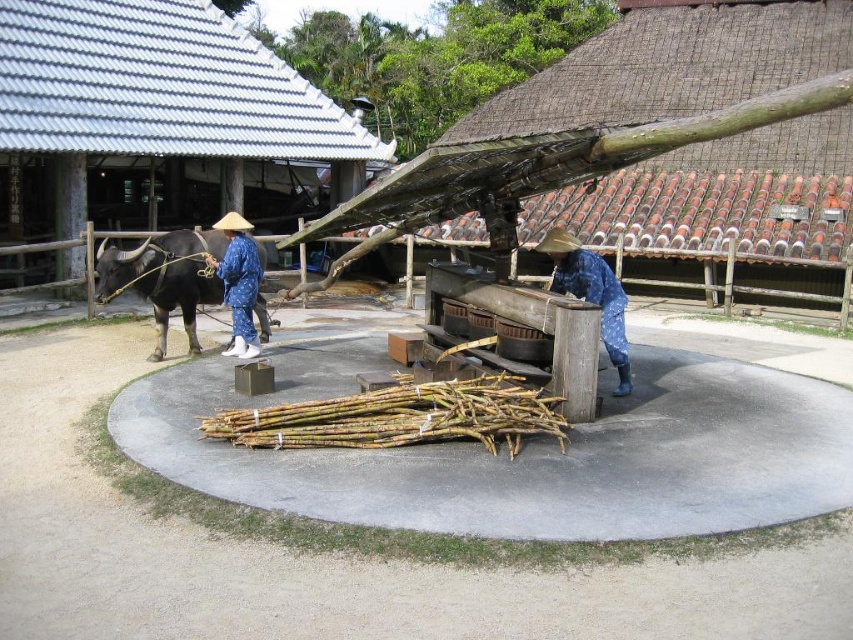
Question: Does blue dotted fabric at center appear on the right side of blue fabric hat at center?

Choices:
 (A) yes
 (B) no

Answer: (A)

Question: Which is farther from the blue dotted fabric at center?

Choices:
 (A) brown rough sugar cane at center
 (B) blue fabric hat at center

Answer: (B)

Question: Considering the real-world distances, which object is closest to the blue fabric hat at center?

Choices:
 (A) brown glossy bull at left
 (B) brown rough sugar cane at center
 (C) blue dotted fabric at center

Answer: (A)

Question: Where is blue dotted fabric at center located in relation to blue fabric hat at center in the image?

Choices:
 (A) right
 (B) left

Answer: (A)

Question: Does brown rough sugar cane at center lie in front of brown glossy bull at left?

Choices:
 (A) yes
 (B) no

Answer: (A)

Question: Among these points, which one is farthest from the camera?

Choices:
 (A) (590, 458)
 (B) (231, 314)

Answer: (B)